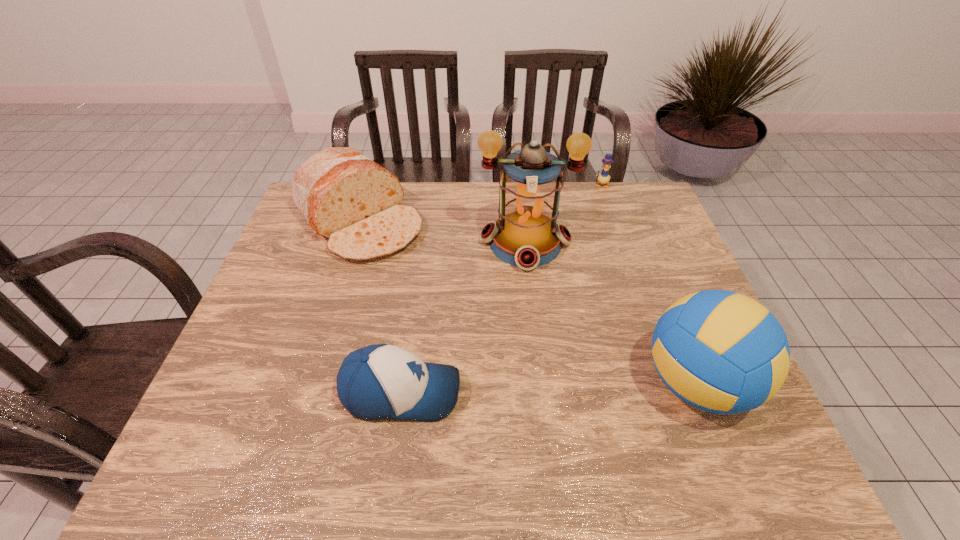
Locate an element on the screen. The width and height of the screenshot is (960, 540). vacant region at the left edge is located at coordinates (260, 315).

Locate an element on the screen. Image resolution: width=960 pixels, height=540 pixels. blank space at the right edge of the desktop is located at coordinates 626,242.

What are the coordinates of `vacant space at the far right corner of the desktop` in the screenshot? It's located at (616, 225).

You are a GUI agent. You are given a task and a screenshot of the screen. Output one action in this format:
    pyautogui.click(x=<x>, y=<y>)
    Task: Click on the vacant space in between the tallest object and the duckling
    
    Given the screenshot: What is the action you would take?
    pyautogui.click(x=564, y=214)

You are a GUI agent. You are given a task and a screenshot of the screen. Output one action in this format:
    pyautogui.click(x=<x>, y=<y>)
    Task: Click on the free space between the baseball cap and the fourth shortest object
    Image resolution: width=960 pixels, height=540 pixels.
    Given the screenshot: What is the action you would take?
    pyautogui.click(x=549, y=388)

Image resolution: width=960 pixels, height=540 pixels. Identify the location of unoccupied area between the tallest object and the bread. (443, 232).

Image resolution: width=960 pixels, height=540 pixels. I want to click on empty space that is in between the volleyball and the third object from right to left, so click(611, 313).

Find the location of a particular element. The height and width of the screenshot is (540, 960). vacant region between the tallest object and the bread is located at coordinates (443, 232).

The width and height of the screenshot is (960, 540). Identify the location of vacant space in between the bread and the lantern. (443, 232).

Locate an element on the screen. This screenshot has width=960, height=540. vacant area that lies between the lantern and the baseball cap is located at coordinates (464, 318).